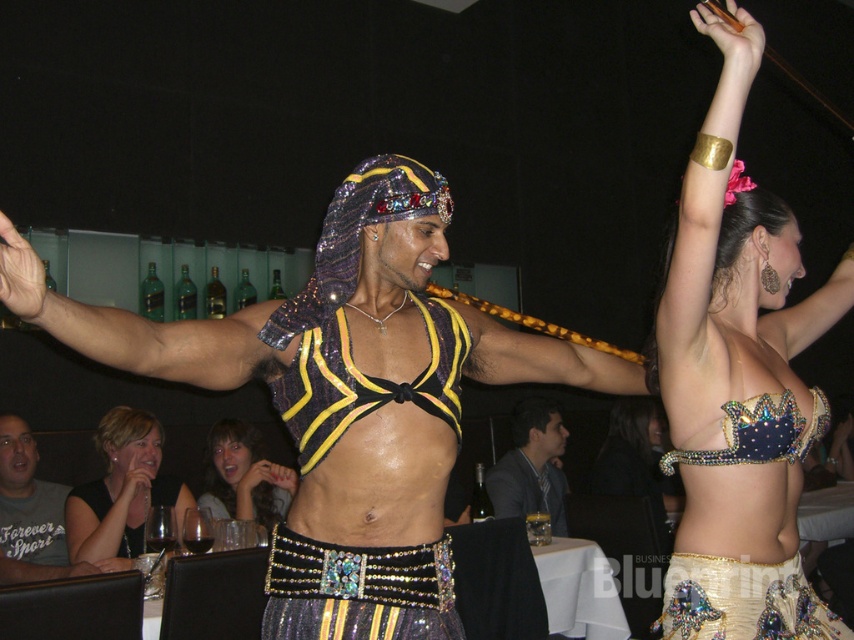
Question: Can you confirm if shiny sequined top at center is positioned above black fabric dress at lower left?

Choices:
 (A) yes
 (B) no

Answer: (A)

Question: Does shiny sequined bikini top at center have a smaller size compared to gray cotton t-shirt at lower left?

Choices:
 (A) yes
 (B) no

Answer: (A)

Question: Which of the following is the closest to the observer?

Choices:
 (A) gray cotton t-shirt at lower left
 (B) shiny black hair at center
 (C) shiny sequined top at center

Answer: (C)

Question: Is shiny gold belt at center wider than black fabric dress at lower left?

Choices:
 (A) no
 (B) yes

Answer: (B)

Question: Among these points, which one is nearest to the camera?

Choices:
 (A) (36, 451)
 (B) (192, 358)
 (C) (531, 512)
 (D) (115, 493)

Answer: (B)

Question: Considering the real-world distances, which object is farthest from the shiny metallic arm at center?

Choices:
 (A) black fabric dress at lower left
 (B) gray suit at center

Answer: (B)